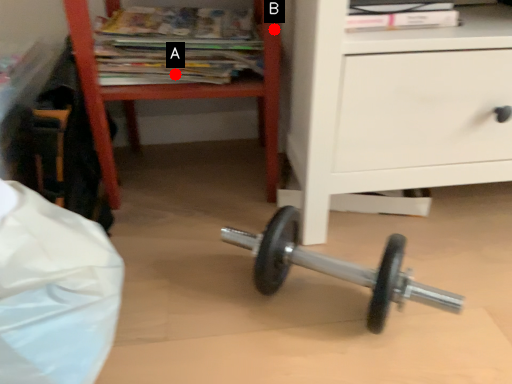
Question: Two points are circled on the image, labeled by A and B beside each circle. Which point is closer to the camera?

Choices:
 (A) A is closer
 (B) B is closer

Answer: (B)